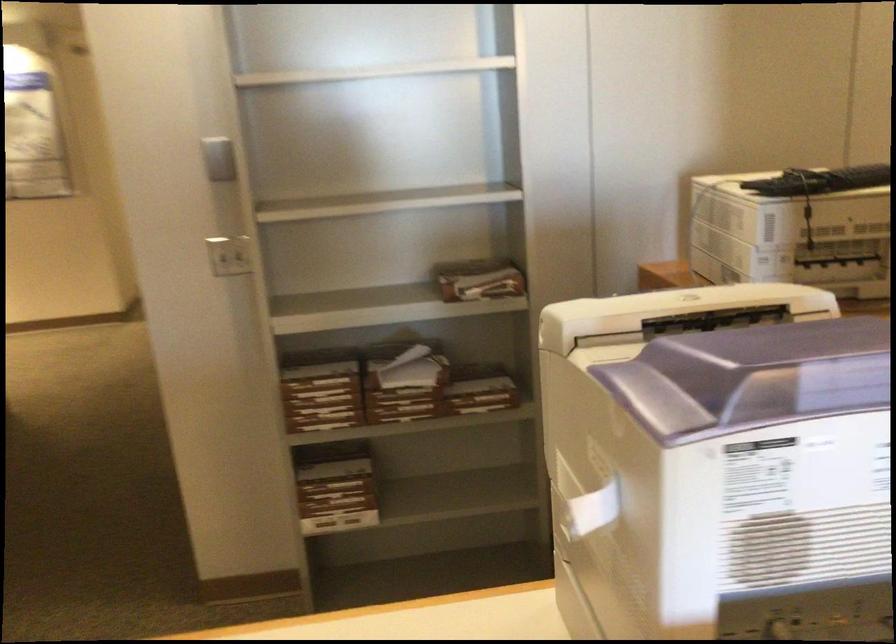
The image size is (896, 644). What do you see at coordinates (780, 368) in the screenshot?
I see `the purple printer lid` at bounding box center [780, 368].